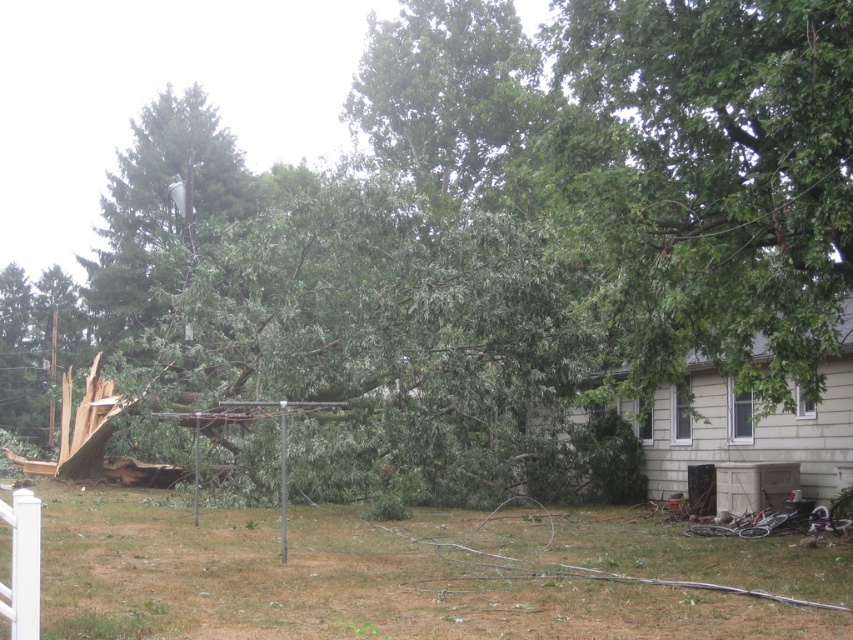
You are a cleanup crew member standing at the edge of the property. You need to prioritize removing the brown wood debris at lower center and the green leafy tree at upper left. Which object should you tackle first based on their proximity to you?

The brown wood debris at lower center is closer to the viewer than the green leafy tree at upper left, so you should prioritize removing the brown wood debris at lower center first.

You are a city planner reviewing the storm damage. You see the green leafy tree at upper right and the green leafy tree at upper left in the image. Which tree is closer to the house in the background?

The green leafy tree at upper right is positioned under green leafy tree at upper left, so the green leafy tree at upper right is closer to the house in the background.